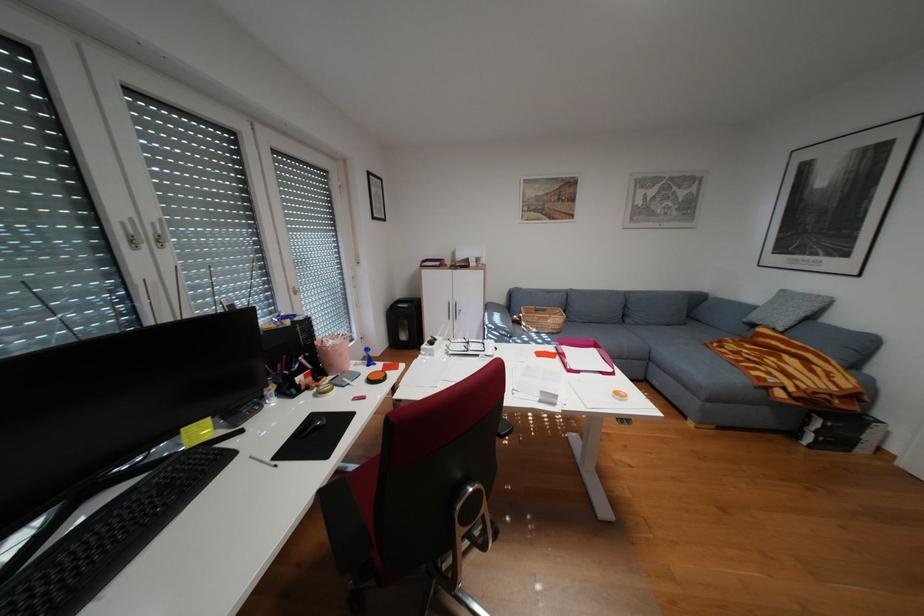
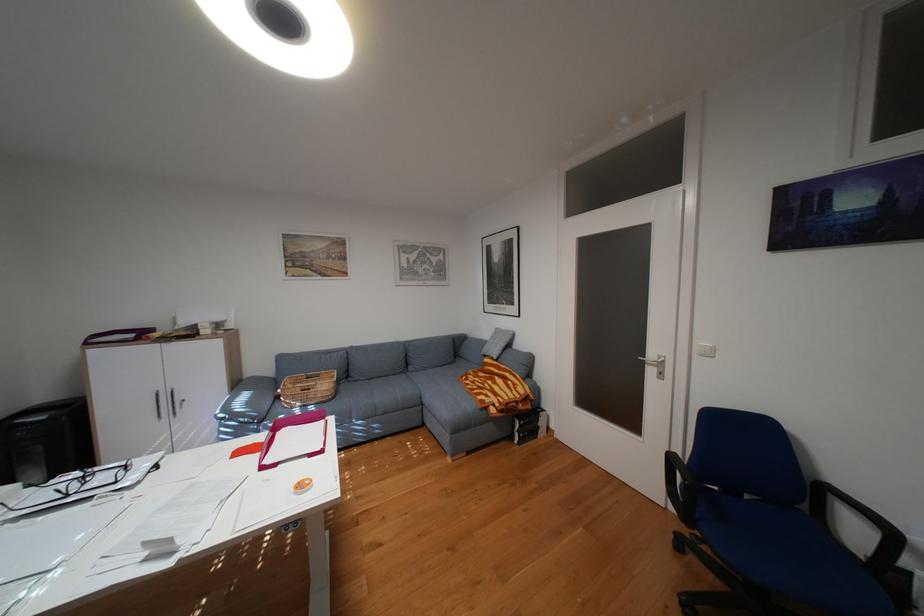
The point at (466, 310) is marked in the first image. Where is the corresponding point in the second image?

(180, 403)